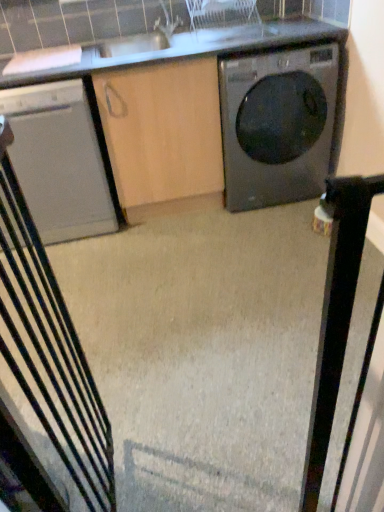
Question: From their relative heights in the image, would you say white glossy countertop at upper center is taller or shorter than metallic gray rocking chair at left?

Choices:
 (A) short
 (B) tall

Answer: (A)

Question: Considering the positions of point (334, 29) and point (54, 325), is point (334, 29) closer or farther from the camera than point (54, 325)?

Choices:
 (A) closer
 (B) farther

Answer: (B)

Question: Which object is positioned farthest from the matte black washing machine at right?

Choices:
 (A) white glossy countertop at upper center
 (B) satin white dishwasher at left
 (C) metallic gray rocking chair at left

Answer: (C)

Question: Which is farther from the metallic gray rocking chair at left?

Choices:
 (A) satin white dishwasher at left
 (B) white glossy countertop at upper center
 (C) matte black washing machine at right

Answer: (C)